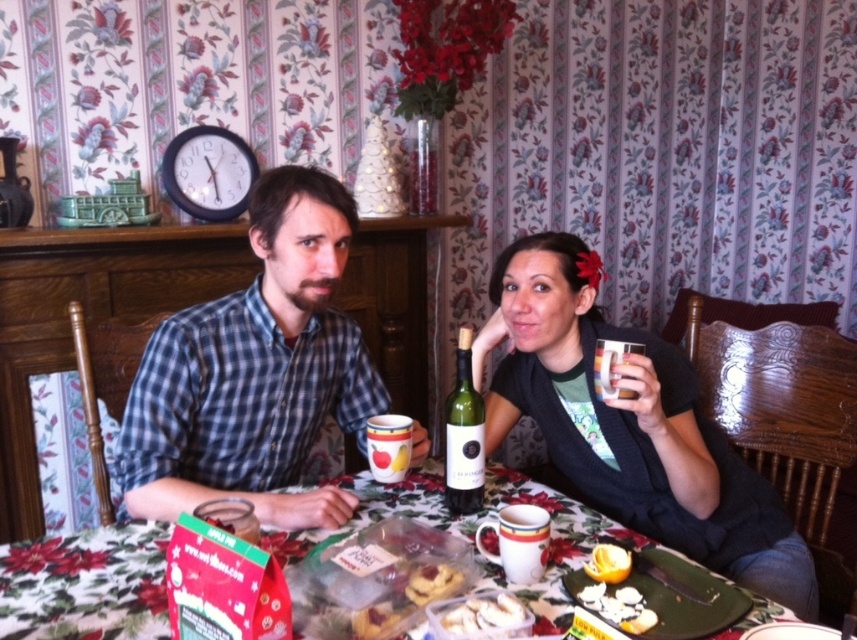
You are a waiter in a restaurant and need to place a dessert order for the customers seated at the table with the matte black sweater at center and the golden brown crumbly pastry at table center. Which item is located to the left of the pastry?

The golden brown crumbly pastry at table center has the matte black sweater at center positioned to its right, so the pastry is on the left side.

You are a photographer trying to capture a closeup of the golden brown crumbly pastry at table center without the matte black sweater at center blocking the view. Is this possible given their positions?

The matte black sweater at center is further to the viewer than the golden brown crumbly pastry at table center, so the sweater would block the view of the pastry. Adjust your angle or move the sweater to get an unobstructed shot.